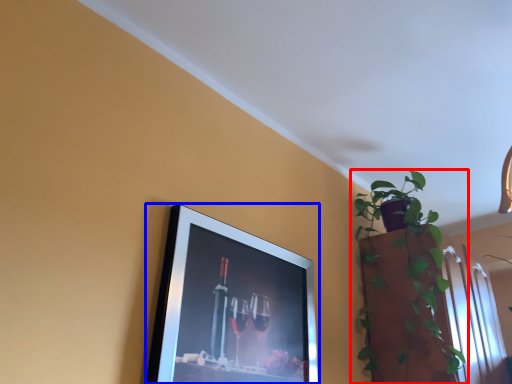
Question: Among these objects, which one is nearest to the camera, houseplant (highlighted by a red box) or picture frame (highlighted by a blue box)?

Choices:
 (A) houseplant
 (B) picture frame

Answer: (B)